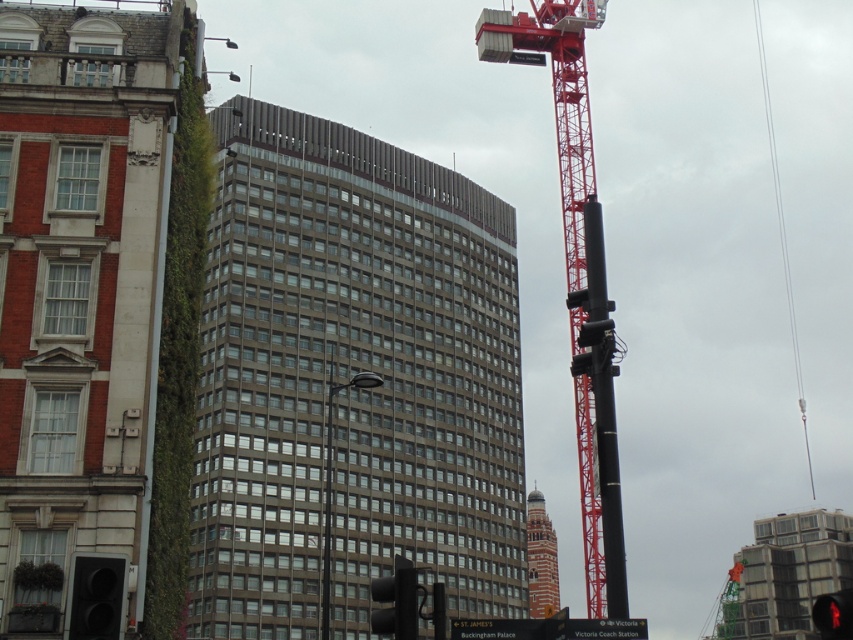
Question: Does black matte traffic light at lower left have a larger size compared to red glass traffic light at lower right?

Choices:
 (A) no
 (B) yes

Answer: (A)

Question: Which object appears closest to the camera in this image?

Choices:
 (A) black matte traffic light at lower left
 (B) black matte pole at right
 (C) red glass traffic light at lower right
 (D) brown glass building at center

Answer: (A)

Question: Is black matte traffic light at lower left to the right of red glass traffic light at lower right from the viewer's perspective?

Choices:
 (A) yes
 (B) no

Answer: (B)

Question: Which of the following is the farthest from the observer?

Choices:
 (A) (575, 268)
 (B) (584, 346)

Answer: (A)

Question: Is black matte traffic light at lower left positioned at the back of brick tower at center?

Choices:
 (A) yes
 (B) no

Answer: (B)

Question: Which of the following is the closest to the observer?

Choices:
 (A) (410, 634)
 (B) (608, 508)
 (C) (833, 611)

Answer: (C)